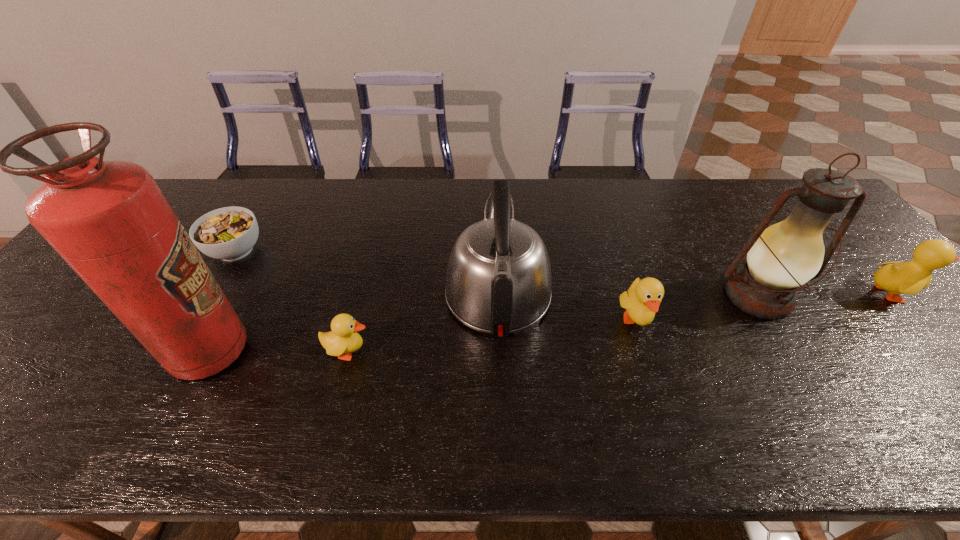
Identify the location of the second object from right to left. (781, 258).

In order to click on blank space located on the front-facing side of the fifth object from right to left in this screenshot , I will do `click(514, 352)`.

Locate an element on the screen. Image resolution: width=960 pixels, height=540 pixels. vacant area situated on the front-facing side of the third object from right to left is located at coordinates (650, 364).

This screenshot has width=960, height=540. Identify the location of vacant space located 0.220m on the spout of the fourth object from left to right. (494, 201).

Where is `free space located on the spout of the fourth object from left to right`? free space located on the spout of the fourth object from left to right is located at coordinates (494, 203).

Where is `vacant region located 0.240m on the spout of the fourth object from left to right`? The height and width of the screenshot is (540, 960). vacant region located 0.240m on the spout of the fourth object from left to right is located at coordinates (494, 198).

The width and height of the screenshot is (960, 540). I want to click on free spot located on the front of the shortest object, so click(165, 375).

This screenshot has height=540, width=960. Find the location of `free region located 0.140m on the label side of the fire extinguisher`. free region located 0.140m on the label side of the fire extinguisher is located at coordinates (307, 352).

This screenshot has width=960, height=540. What are the coordinates of `free spot located on the back of the sixth shortest object` in the screenshot? It's located at (702, 200).

Find the location of `object situated at the near edge`. object situated at the near edge is located at coordinates (109, 220).